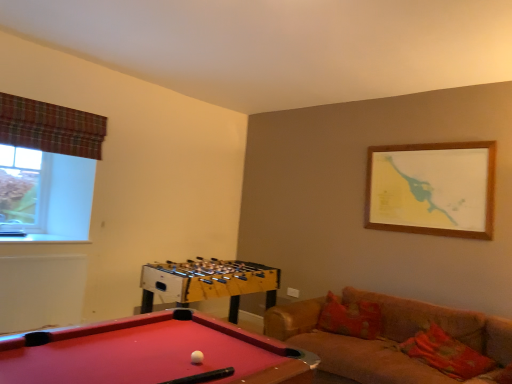
What do you see at coordinates (446, 354) in the screenshot? The width and height of the screenshot is (512, 384). I see `floral fabric pillow at lower right` at bounding box center [446, 354].

Measure the distance between smooth red pool table at lower left and camera.

The depth of smooth red pool table at lower left is 1.48 meters.

The height and width of the screenshot is (384, 512). In order to click on white matte ball at center in this screenshot , I will do `click(197, 357)`.

The width and height of the screenshot is (512, 384). What are the coordinates of `clear glass window at upper left` in the screenshot? It's located at (20, 188).

Where is `velvet brown couch at lower right`? velvet brown couch at lower right is located at coordinates (387, 338).

Identify the location of floral fabric pillow at lower right. Image resolution: width=512 pixels, height=384 pixels. (446, 354).

Is white matte ball at center completely or partially inside smooth red pool table at lower left?

Yes, smooth red pool table at lower left contains white matte ball at center.

From the picture: Between smooth red pool table at lower left and white matte ball at center, which one appears on the right side from the viewer's perspective?

white matte ball at center.

Consider the image. Does smooth red pool table at lower left have a greater width compared to white matte ball at center?

Yes, smooth red pool table at lower left is wider than white matte ball at center.

How much distance is there between smooth red pool table at lower left and white matte ball at center?

A distance of 13.64 inches exists between smooth red pool table at lower left and white matte ball at center.

Is point (23, 382) farther from viewer compared to point (436, 353)?

No.

Considering the positions of objects smooth red pool table at lower left and floral fabric pillow at lower right in the image provided, who is more to the right, smooth red pool table at lower left or floral fabric pillow at lower right?

floral fabric pillow at lower right is more to the right.

Can you confirm if floral fabric pillow at lower right is positioned to the left of plaid fabric curtain at upper left?

No, floral fabric pillow at lower right is not to the left of plaid fabric curtain at upper left.

Does floral fabric pillow at lower right touch plaid fabric curtain at upper left?

floral fabric pillow at lower right and plaid fabric curtain at upper left are clearly separated.

Could you tell me if floral fabric pillow at lower right is turned towards plaid fabric curtain at upper left?

No, floral fabric pillow at lower right is not aimed at plaid fabric curtain at upper left.

Locate an element on the screen. This screenshot has height=384, width=512. pillow in front of the plaid fabric curtain at upper left is located at coordinates (446, 354).

Is clear glass window at upper left next to white matte ball at center?

Answer: There is a gap between clear glass window at upper left and white matte ball at center.

Considering the positions of points (23, 195) and (201, 352), is point (23, 195) farther from camera compared to point (201, 352)?

Yes, it is.

From the image's perspective, is clear glass window at upper left under white matte ball at center?

No, from the image's perspective, clear glass window at upper left is not beneath white matte ball at center.

Is clear glass window at upper left spatially inside white matte ball at center, or outside of it?

clear glass window at upper left lies outside white matte ball at center.

From a real-world perspective, is clear glass window at upper left positioned above or below plaid fabric curtain at upper left?

Clearly, from a real-world perspective, clear glass window at upper left is below plaid fabric curtain at upper left.

Considering the sizes of objects clear glass window at upper left and plaid fabric curtain at upper left in the image provided, who is taller, clear glass window at upper left or plaid fabric curtain at upper left?

Standing taller between the two is clear glass window at upper left.

Which of these two, clear glass window at upper left or plaid fabric curtain at upper left, is thinner?

plaid fabric curtain at upper left is thinner.

Which is behind, point (28, 155) or point (90, 130)?

Positioned behind is point (28, 155).

Based on the photo, considering the positions of objects white matte ball at center and smooth red pool table at lower left in the image provided, who is more to the left, white matte ball at center or smooth red pool table at lower left?

From the viewer's perspective, smooth red pool table at lower left appears more on the left side.

In the image, is white matte ball at center positioned in front of or behind smooth red pool table at lower left?

Clearly, white matte ball at center is behind smooth red pool table at lower left.

Is white matte ball at center outside of smooth red pool table at lower left?

No.

Identify the location of curtain lying behind the white matte ball at center. (50, 127).

Is white matte ball at center inside plaid fabric curtain at upper left?

No, white matte ball at center is not inside plaid fabric curtain at upper left.

Is plaid fabric curtain at upper left taller than white matte ball at center?

Yes, plaid fabric curtain at upper left is taller than white matte ball at center.

Based on the photo, between plaid fabric curtain at upper left and white matte ball at center, which one has smaller width?

With smaller width is white matte ball at center.

Locate an element on the screen. The height and width of the screenshot is (384, 512). billiard table lying below the white matte ball at center (from the image's perspective) is located at coordinates (151, 353).

Locate an element on the screen. The height and width of the screenshot is (384, 512). billiard table above the floral fabric pillow at lower right (from a real-world perspective) is located at coordinates (151, 353).

When comparing their distances from plaid fabric curtain at upper left, does clear glass window at upper left or smooth red pool table at lower left seem further?

Based on the image, smooth red pool table at lower left appears to be further to plaid fabric curtain at upper left.

Looking at the image, which one is located closer to plaid fabric curtain at upper left, velvet brown couch at lower right or clear glass window at upper left?

Based on the image, clear glass window at upper left appears to be nearer to plaid fabric curtain at upper left.

From the image, which object appears to be farther from smooth red pool table at lower left, plaid fabric curtain at upper left or velvet brown couch at lower right?

Among the two, plaid fabric curtain at upper left is located further to smooth red pool table at lower left.

Based on their spatial positions, is white matte ball at center or floral fabric pillow at lower right further from plaid fabric curtain at upper left?

The object further to plaid fabric curtain at upper left is floral fabric pillow at lower right.

Which object lies further to the anchor point white matte ball at center, smooth red pool table at lower left or velvet brown couch at lower right?

velvet brown couch at lower right lies further to white matte ball at center than the other object.

Estimate the real-world distances between objects in this image. Which object is closer to velvet brown couch at lower right, clear glass window at upper left or white matte ball at center?

white matte ball at center is positioned closer to the anchor velvet brown couch at lower right.

Considering their positions, is clear glass window at upper left positioned closer to smooth red pool table at lower left than velvet brown couch at lower right?

velvet brown couch at lower right is positioned closer to the anchor smooth red pool table at lower left.

Estimate the real-world distances between objects in this image. Which object is further from velvet brown couch at lower right, smooth red pool table at lower left or clear glass window at upper left?

clear glass window at upper left is further to velvet brown couch at lower right.

Identify the location of ball between smooth red pool table at lower left and floral fabric pillow at lower right. (197, 357).

At what (x,y) coordinates should I click in order to perform the action: click on ball between plaid fabric curtain at upper left and velvet brown couch at lower right from left to right. Please return your answer as a coordinate pair (x, y). The height and width of the screenshot is (384, 512). Looking at the image, I should click on (197, 357).

The width and height of the screenshot is (512, 384). I want to click on ball located between smooth red pool table at lower left and velvet brown couch at lower right in the left-right direction, so click(197, 357).

Identify the location of studio couch located between clear glass window at upper left and floral fabric pillow at lower right in the left-right direction. The image size is (512, 384). (387, 338).